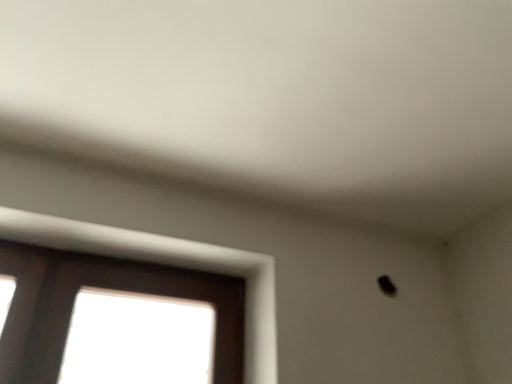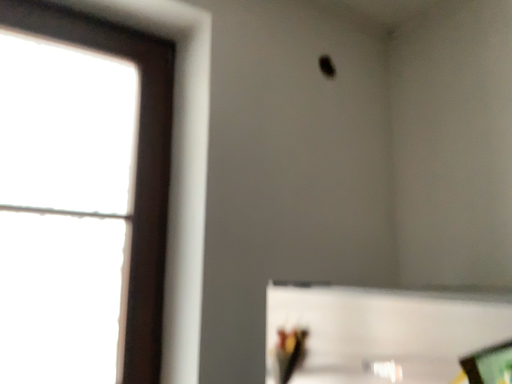
Question: How did the camera likely rotate when shooting the video?

Choices:
 (A) rotated right
 (B) rotated left

Answer: (A)